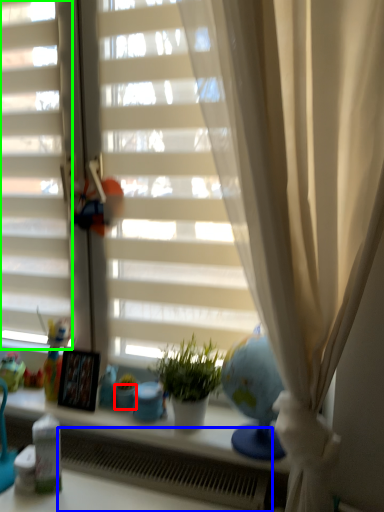
Question: Which object is positioned closest to glass vase (highlighted by a red box)? Select from radiator (highlighted by a blue box) and shutter (highlighted by a green box).

Choices:
 (A) radiator
 (B) shutter

Answer: (A)